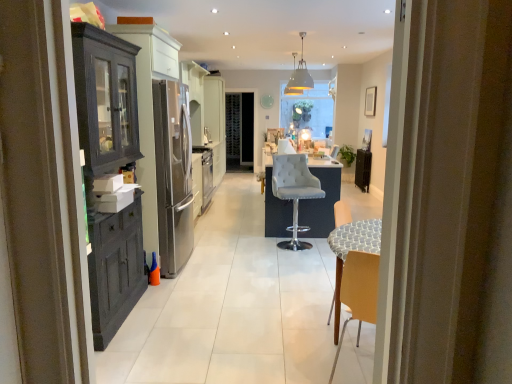
Question: In terms of size, does matte dark wood cabinet at left appear bigger or smaller than black metallic radiator at right?

Choices:
 (A) small
 (B) big

Answer: (B)

Question: Based on their positions, is matte dark wood cabinet at left located to the left or right of black metallic radiator at right?

Choices:
 (A) left
 (B) right

Answer: (A)

Question: Based on their relative distances, which object is nearer to the gray fabric bar stool at center?

Choices:
 (A) matte dark wood cabinet at left
 (B) metallic pendant light at upper center
 (C) black metallic radiator at right

Answer: (A)

Question: Considering the real-world distances, which object is closest to the metallic pendant light at upper center?

Choices:
 (A) black metallic radiator at right
 (B) matte dark wood cabinet at left
 (C) gray fabric bar stool at center

Answer: (A)